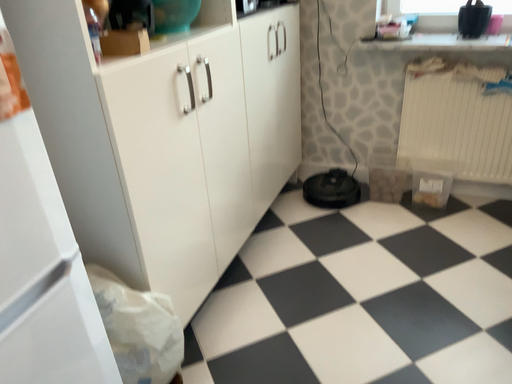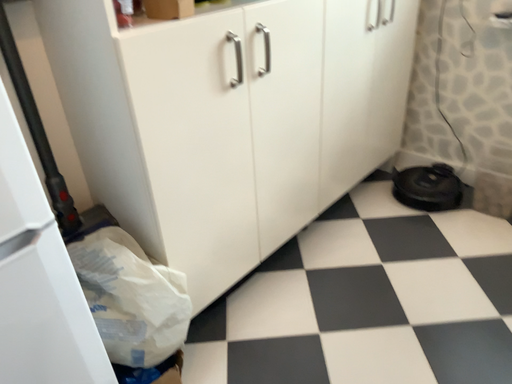
Question: Which way did the camera rotate in the video?

Choices:
 (A) rotated left
 (B) rotated right

Answer: (A)